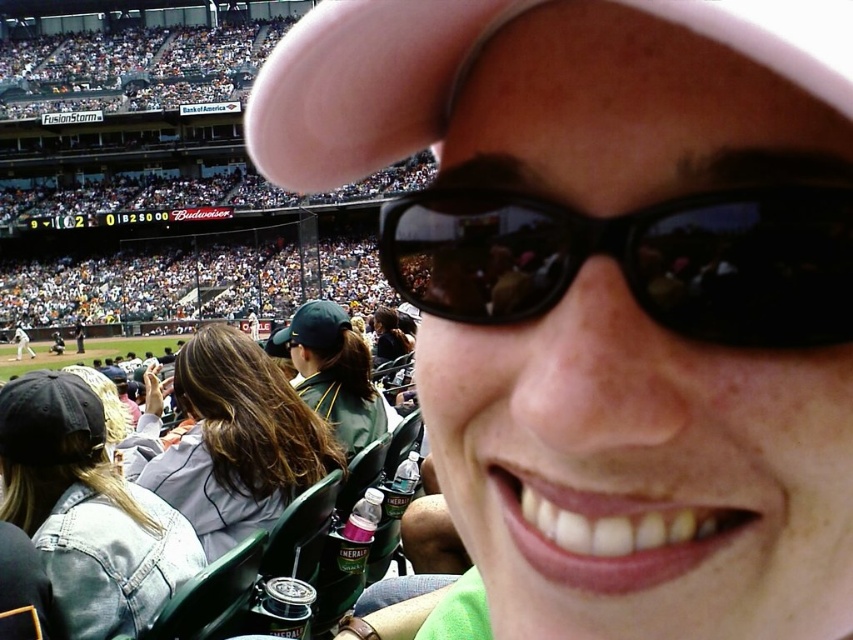
You are a photographer at the stadium and want to capture a photo of both the black plastic sunglasses at center and the denim jacket at lower left in the same frame without moving your position. Can you do it?

The black plastic sunglasses at center is 16.62 meters away from the denim jacket at lower left. Since both objects are within the same scene and the distance between them is manageable for a camera lens, you can capture both in the same frame without moving your position.

Based on the photo, you are a photographer at the baseball stadium and want to take a photo of the green fabric jacket at center without the black plastic sunglasses at center blocking it. How can you adjust your camera angle to achieve this?

The black plastic sunglasses at center is positioned over the green fabric jacket at center. To avoid blocking the jacket, you can lower the camera angle to capture the jacket below the sunglasses.

You are a photographer trying to capture a clear shot of both the pink fabric cap at upper center and the green fabric cap at center. Based on their positions, which cap is closer to the camera?

The pink fabric cap at upper center is closer to the camera because it is in front of the green fabric cap at center.